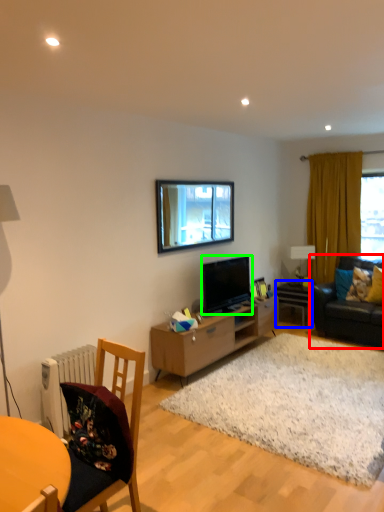
Question: Considering the real-world distances, which object is closest to studio couch (highlighted by a red box)? table (highlighted by a blue box) or television (highlighted by a green box).

Choices:
 (A) table
 (B) television

Answer: (A)